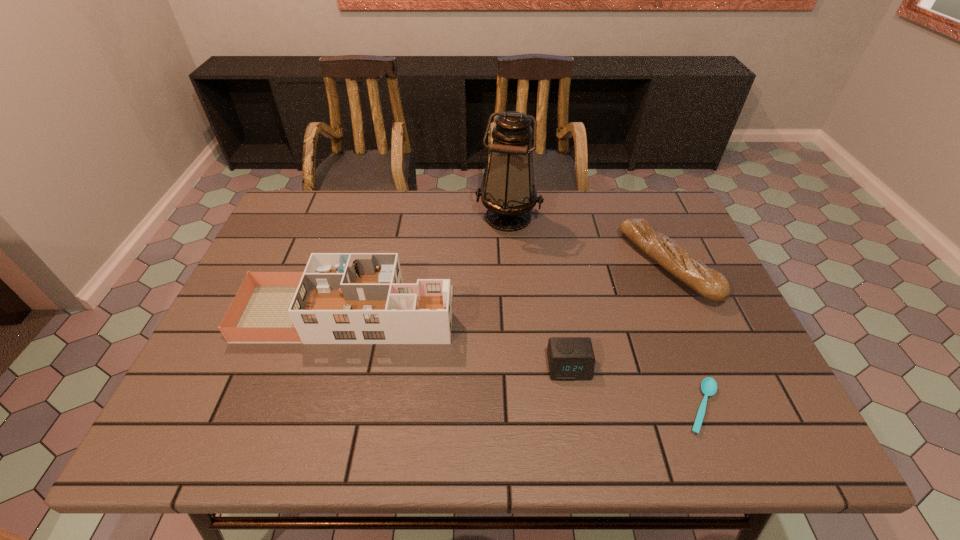
Identify the location of vacant space at the near edge of the desktop. The width and height of the screenshot is (960, 540). (418, 430).

Image resolution: width=960 pixels, height=540 pixels. In order to click on vacant space at the left edge in this screenshot , I will do pos(265,373).

Locate an element on the screen. free space at the right edge is located at coordinates (694, 294).

Image resolution: width=960 pixels, height=540 pixels. I want to click on blank space at the far left corner of the desktop, so click(x=319, y=206).

At what (x,y) coordinates should I click in order to perform the action: click on free region at the far right corner of the desktop. Please return your answer as a coordinate pair (x, y). Looking at the image, I should click on (660, 213).

The height and width of the screenshot is (540, 960). In order to click on vacant space that's between the second shortest object and the dollhouse in this screenshot , I will do `click(458, 340)`.

Identify the location of vacant area that lies between the third shortest object and the oil lamp. This screenshot has width=960, height=540. (588, 241).

You are a GUI agent. You are given a task and a screenshot of the screen. Output one action in this format:
    pyautogui.click(x=<x>, y=<y>)
    Task: Click on the vacant region between the second shortest object and the leftmost object
    
    Given the screenshot: What is the action you would take?
    pyautogui.click(x=458, y=340)

At what (x,y) coordinates should I click in order to perform the action: click on free space that is in between the oil lamp and the second tallest object. Please return your answer as a coordinate pair (x, y). Looking at the image, I should click on (428, 265).

This screenshot has height=540, width=960. What are the coordinates of `vacant area between the leftmost object and the spoon` in the screenshot? It's located at (525, 360).